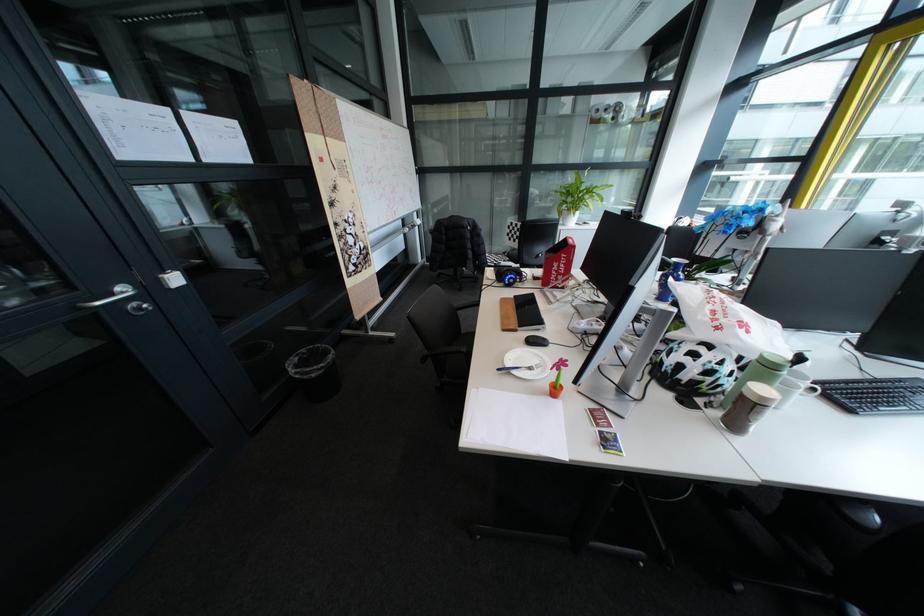
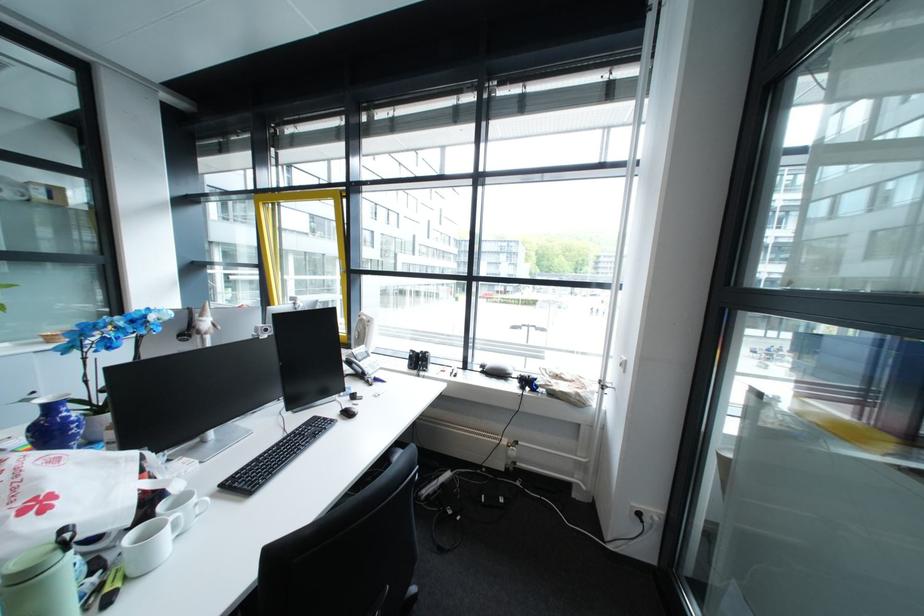
Question: How did the camera likely rotate?

Choices:
 (A) Left
 (B) Right
 (C) Up
 (D) Down

Answer: (B)